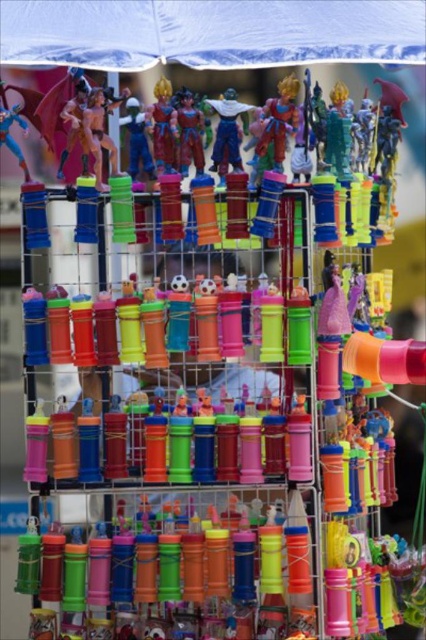
Question: Among these objects, which one is farthest from the camera?

Choices:
 (A) matte plastic action figure at center
 (B) shiny plastic figure at center
 (C) shiny plastic action figure at center

Answer: (C)

Question: Which point is farther from the camera taking this photo?

Choices:
 (A) (169, 148)
 (B) (224, 118)

Answer: (A)

Question: Can you confirm if matte plastic action figure at center is positioned below shiny plastic action figure at center?

Choices:
 (A) no
 (B) yes

Answer: (A)

Question: Can you confirm if matte plastic action figure at center is wider than shiny plastic figure at center?

Choices:
 (A) no
 (B) yes

Answer: (B)

Question: Does shiny plastic figure at center appear on the left side of shiny plastic action figure at center?

Choices:
 (A) yes
 (B) no

Answer: (A)

Question: Which point is closer to the camera taking this photo?

Choices:
 (A) (181, 154)
 (B) (172, 150)

Answer: (A)